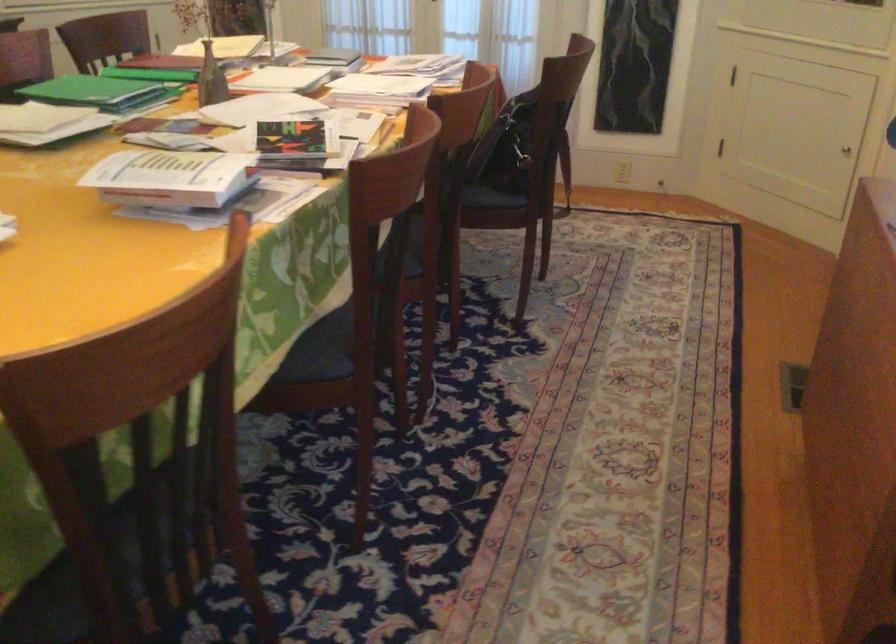
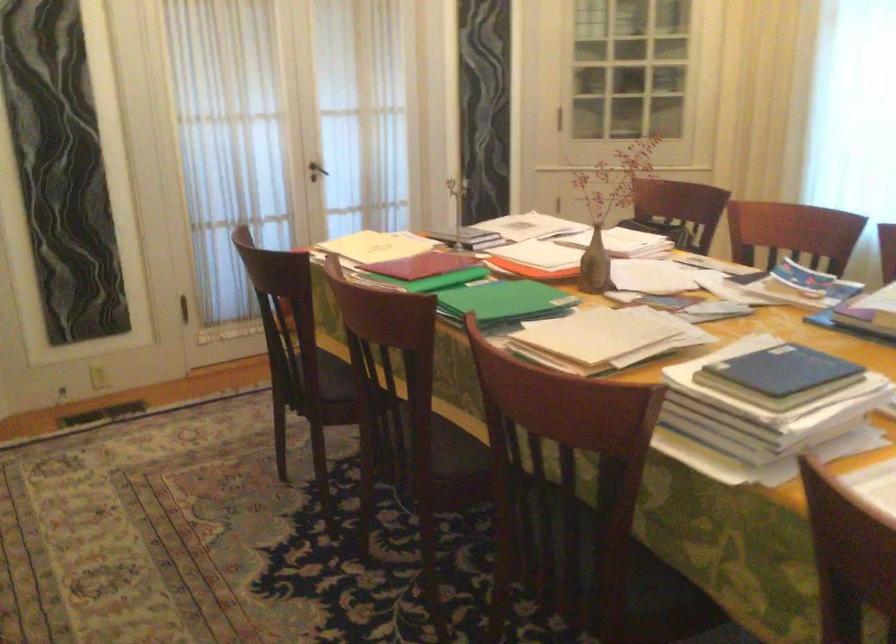
Question: I am providing you with two images of the same scene from different viewpoints. Which of the following objects are not visible in image2?

Choices:
 (A) dark door handle
 (B) small brown vase
 (C) black knob
 (D) black bag strap

Answer: (D)